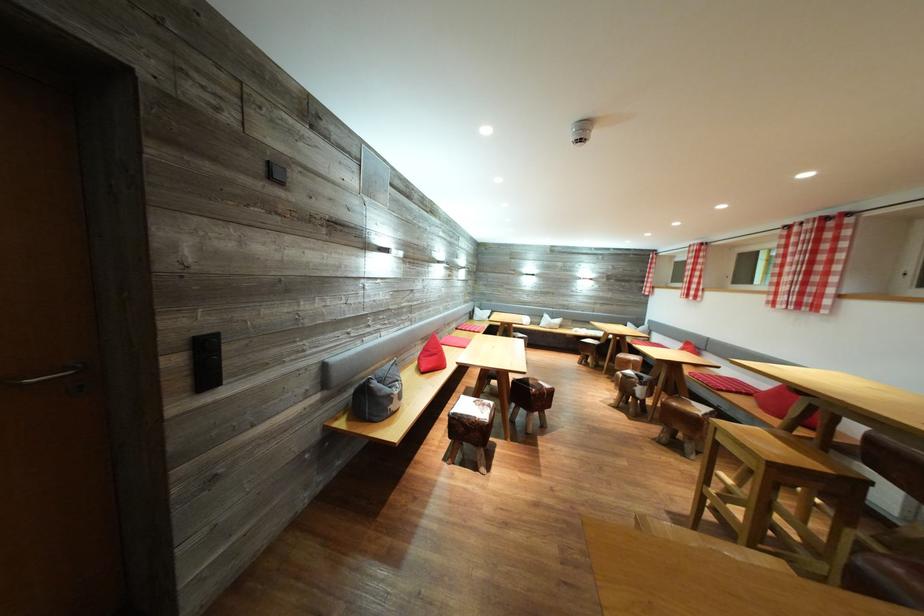
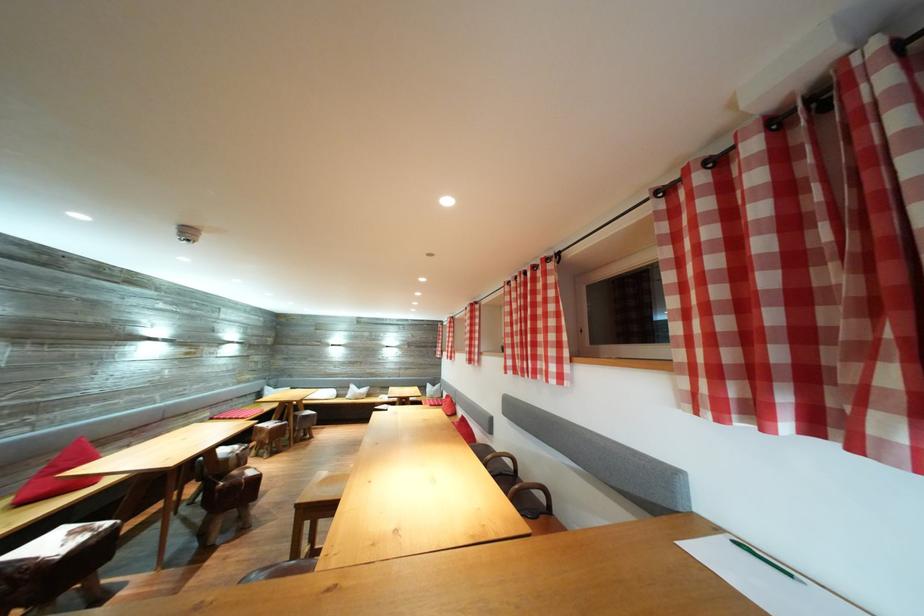
The point at (808,299) is marked in the first image. Where is the corresponding point in the second image?

(477, 359)